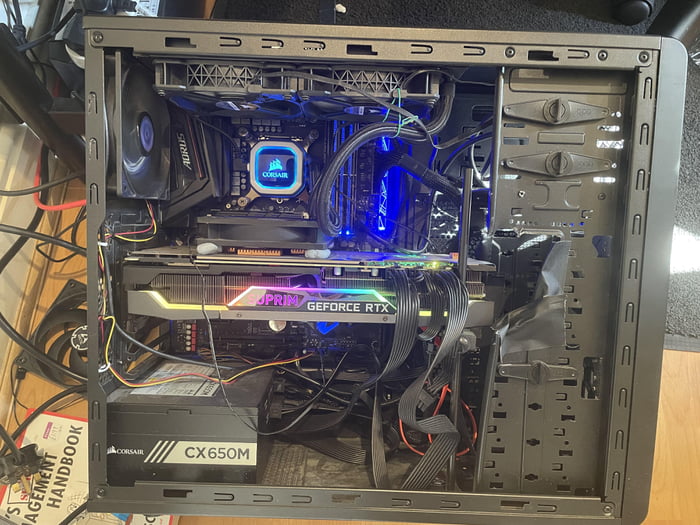
I want to click on red border on book, so click(76, 420).